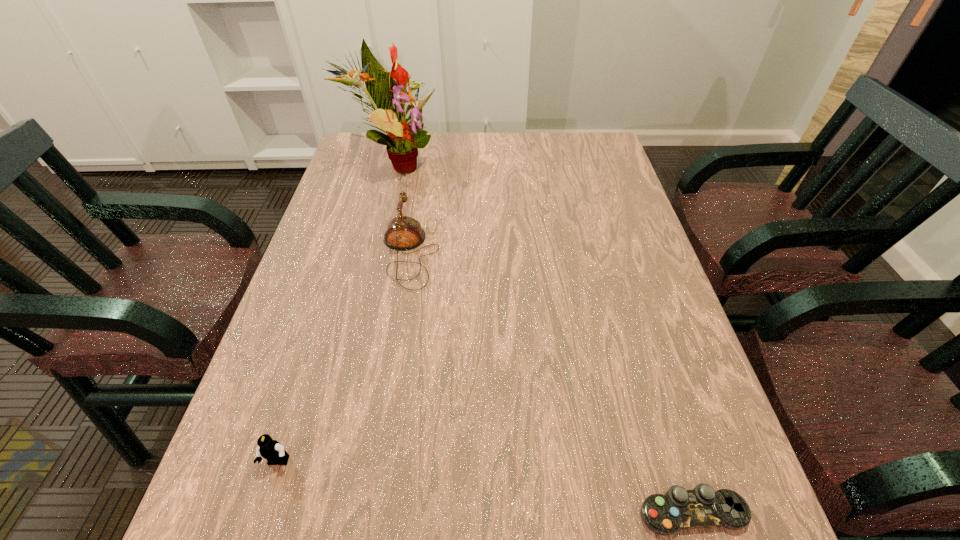
Identify the location of free spot located 0.070m on the front-facing side of the third tallest object. (261, 517).

This screenshot has width=960, height=540. I want to click on free space located on the left of the nearest object, so click(506, 512).

In order to click on object that is at the far edge in this screenshot , I will do `click(387, 92)`.

The image size is (960, 540). Identify the location of object situated at the near edge. (679, 509).

What are the coordinates of `bouquet situated at the left edge` in the screenshot? It's located at (387, 92).

Where is `Lego at the left edge`? The width and height of the screenshot is (960, 540). Lego at the left edge is located at coordinates (271, 450).

Where is `object at the right edge`? The width and height of the screenshot is (960, 540). object at the right edge is located at coordinates (679, 509).

In order to click on object present at the far left corner in this screenshot , I will do `click(387, 92)`.

Identify the location of object positioned at the near right corner. This screenshot has height=540, width=960. (679, 509).

The height and width of the screenshot is (540, 960). Find the location of `free space at the far edge of the desktop`. free space at the far edge of the desktop is located at coordinates (506, 141).